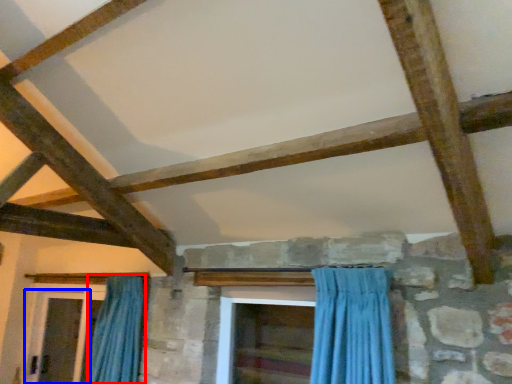
Question: Which of the following is the closest to the observer, curtain (highlighted by a red box) or screen door (highlighted by a blue box)?

Choices:
 (A) curtain
 (B) screen door

Answer: (A)